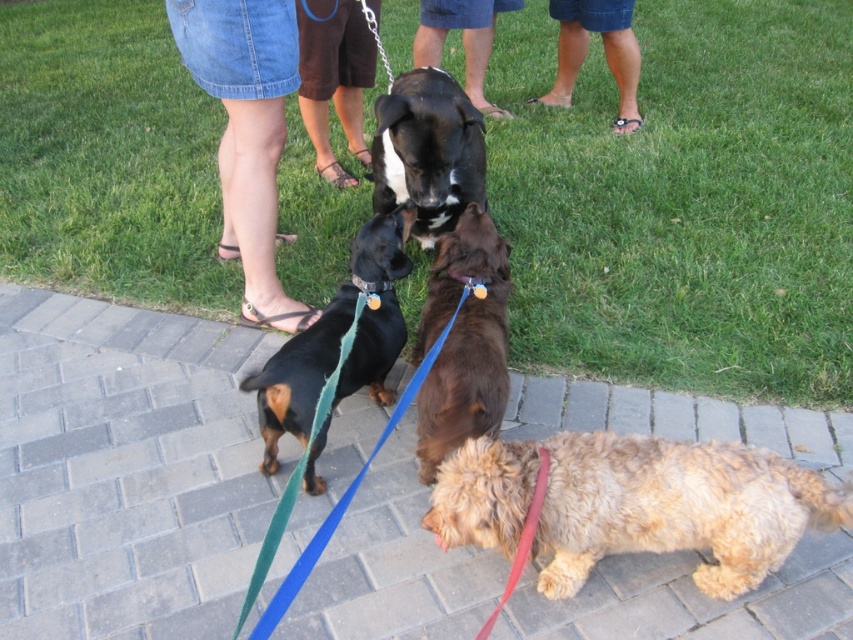
Does green grass at center appear under green fabric leash at center?

Incorrect, green grass at center is not positioned below green fabric leash at center.

This screenshot has width=853, height=640. Describe the element at coordinates (685, 202) in the screenshot. I see `green grass at center` at that location.

I want to click on green grass at center, so click(x=685, y=202).

Is point (566, 582) in front of point (276, 364)?

Yes, it is in front of point (276, 364).

How much distance is there between fuzzy brown dog at lower right and black shiny dog at center?

A distance of 32.79 inches exists between fuzzy brown dog at lower right and black shiny dog at center.

Does point (564, 582) come in front of point (260, 428)?

Yes.

The height and width of the screenshot is (640, 853). I want to click on fuzzy brown dog at lower right, so click(634, 504).

Does point (291, 632) lie behind point (434, 406)?

No.

Consider the image. Who is more forward, [640,556] or [503,292]?

Point [640,556]

Find the location of a particular element. brick pavement at lower center is located at coordinates (125, 468).